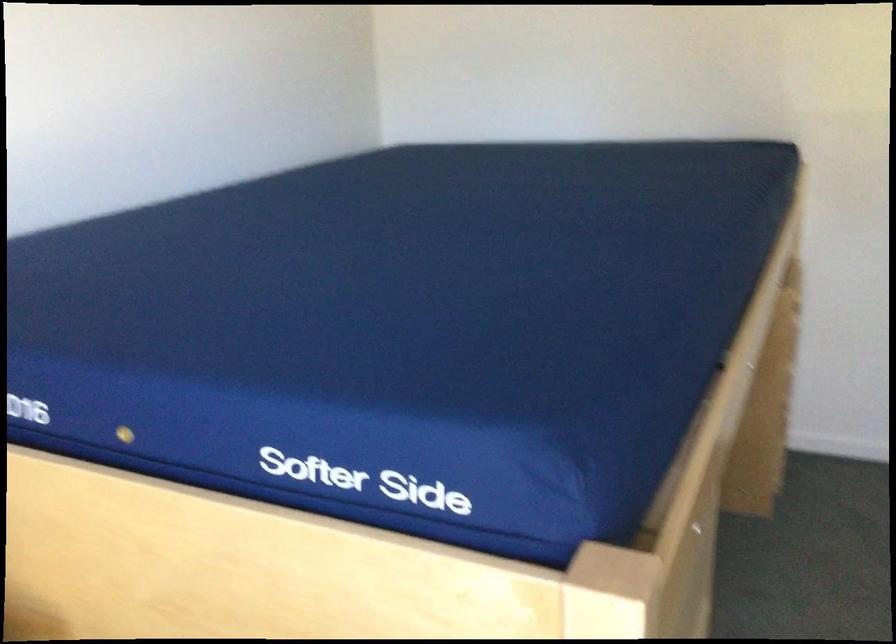
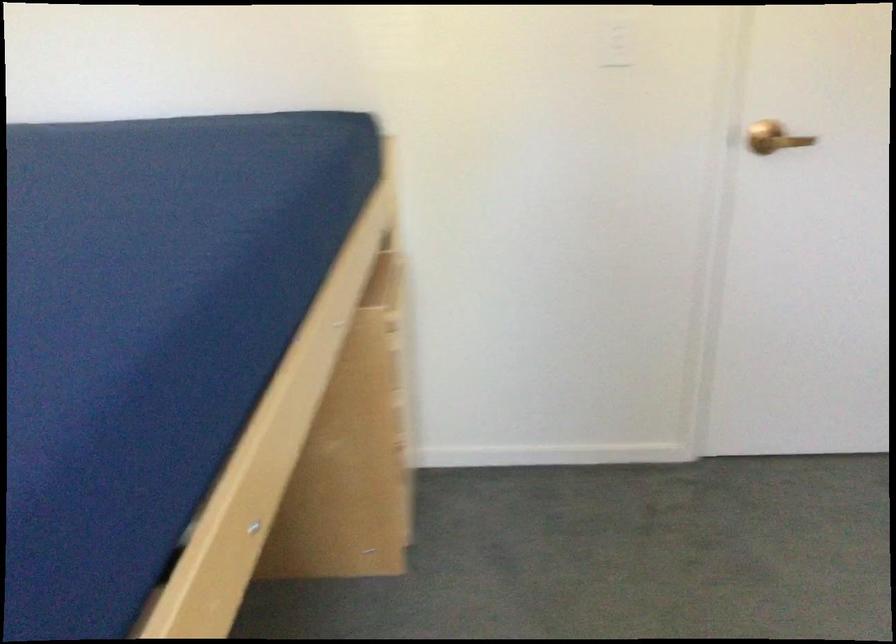
Question: The camera is either moving clockwise (left) or counter-clockwise (right) around the object. The first image is from the beginning of the video and the second image is from the end. Is the camera moving left or right when shooting the video?

Choices:
 (A) Left
 (B) Right

Answer: (A)